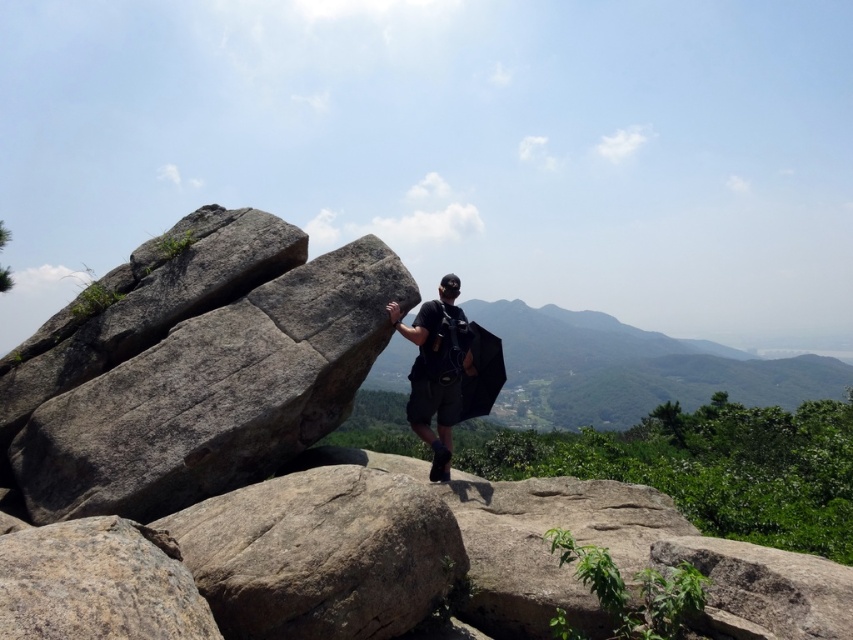
Does gray rough boulder at center have a greater height compared to gray rough boulder at lower left?

Correct, gray rough boulder at center is much taller as gray rough boulder at lower left.

Does point (357, 486) lie behind point (56, 614)?

Yes, it is behind point (56, 614).

What are the coordinates of `gray rough boulder at center` in the screenshot? It's located at (321, 554).

Is gray rough rock at left bigger than gray rough boulder at lower left?

Correct, gray rough rock at left is larger in size than gray rough boulder at lower left.

Does point (126, 371) come in front of point (56, 556)?

No, (126, 371) is further to viewer.

Where is `gray rough rock at left`? gray rough rock at left is located at coordinates (204, 372).

From the picture: Who is more forward, (393, 269) or (451, 330)?

Point (393, 269) is in front.

Based on the photo, is the position of gray rough rock at left more distant than that of black matte backpack at center?

No, gray rough rock at left is in front of black matte backpack at center.

You are a GUI agent. You are given a task and a screenshot of the screen. Output one action in this format:
    pyautogui.click(x=<x>, y=<y>)
    Task: Click on the gray rough rock at left
    
    Given the screenshot: What is the action you would take?
    pyautogui.click(x=204, y=372)

Where is `gray rough rock at left`? Image resolution: width=853 pixels, height=640 pixels. gray rough rock at left is located at coordinates (204, 372).